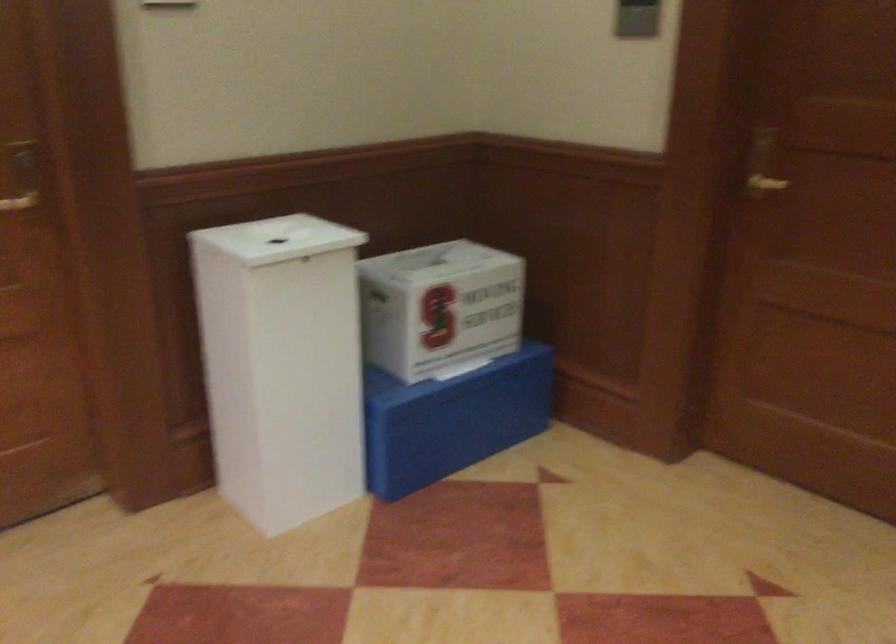
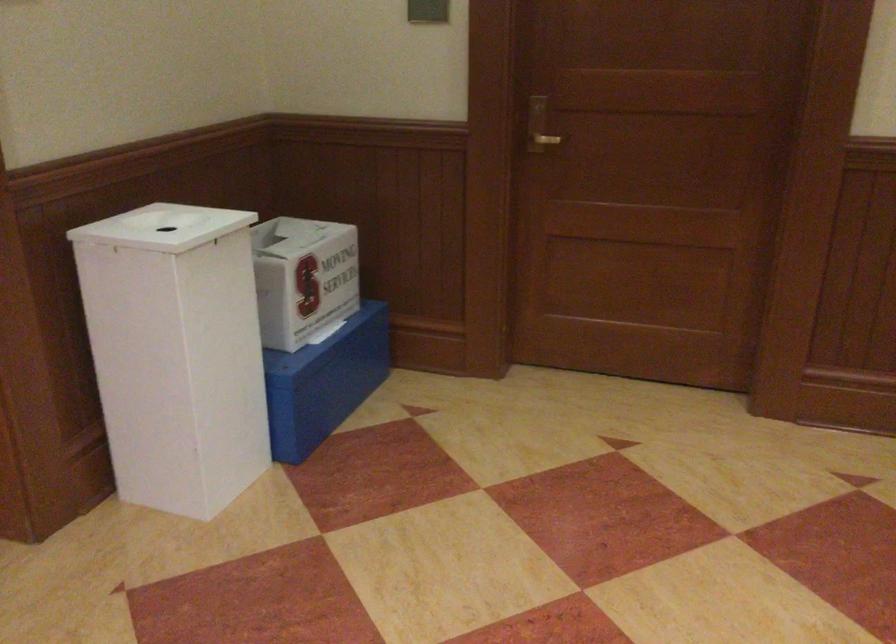
Locate, in the second image, the point that corresponds to (x=440, y=422) in the first image.

(323, 382)